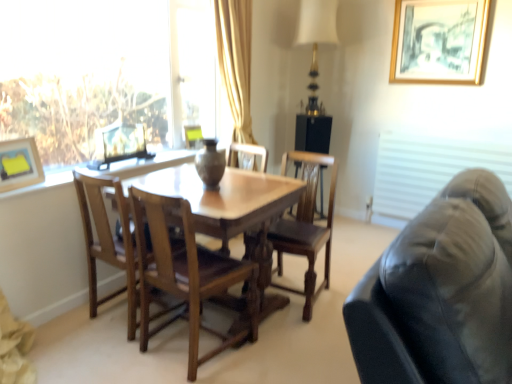
Question: Is matte brown vase at center situated inside white fabric blind at right or outside?

Choices:
 (A) inside
 (B) outside

Answer: (B)

Question: In the image, is matte brown vase at center on the left side or the right side of white fabric blind at right?

Choices:
 (A) left
 (B) right

Answer: (A)

Question: Which is nearer to the white fabric blind at right?

Choices:
 (A) matte yellow picture frame at center, arranged as the second picture frame when viewed from the top
 (B) wooden table at center
 (C) wooden chair at center, placed as the third chair when sorted from left to right
 (D) light brown wood chair at center, which is the 3th chair in right-to-left order
 (E) matte yellow picture frame at upper left, which appears as the first picture frame when ordered from the bottom

Answer: (C)

Question: Which of these objects is positioned closest to the leather couch at right?

Choices:
 (A) gold metallic table lamp at upper center
 (B) transparent glass window at upper left
 (C) matte yellow picture frame at center, placed as the second picture frame when sorted from bottom to top
 (D) matte yellow picture frame at upper left, acting as the third picture frame starting from the right
 (E) white fabric blind at right

Answer: (D)